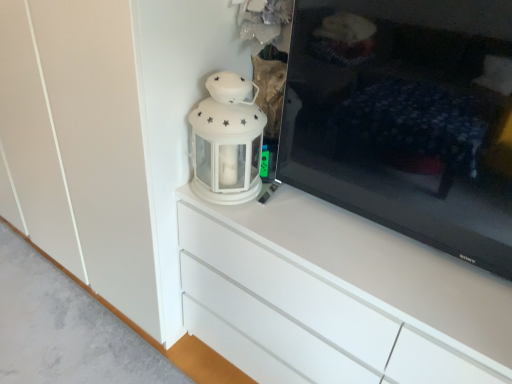
Question: Is white glossy lantern at upper center inside or outside of black glossy tv at right?

Choices:
 (A) inside
 (B) outside

Answer: (B)

Question: Does point (253, 145) appear closer or farther from the camera than point (503, 16)?

Choices:
 (A) closer
 (B) farther

Answer: (B)

Question: Considering the real-world distances, which object is farthest from the white glossy lantern at upper center?

Choices:
 (A) black glossy tv at right
 (B) white glossy chest of drawers at center

Answer: (A)

Question: Based on their relative distances, which object is nearer to the white glossy lantern at upper center?

Choices:
 (A) white glossy chest of drawers at center
 (B) black glossy tv at right

Answer: (A)